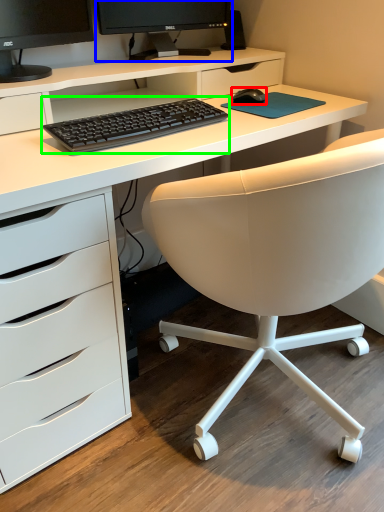
Question: Which is nearer to the mouse (highlighted by a red box)? computer monitor (highlighted by a blue box) or computer keyboard (highlighted by a green box).

Choices:
 (A) computer monitor
 (B) computer keyboard

Answer: (B)